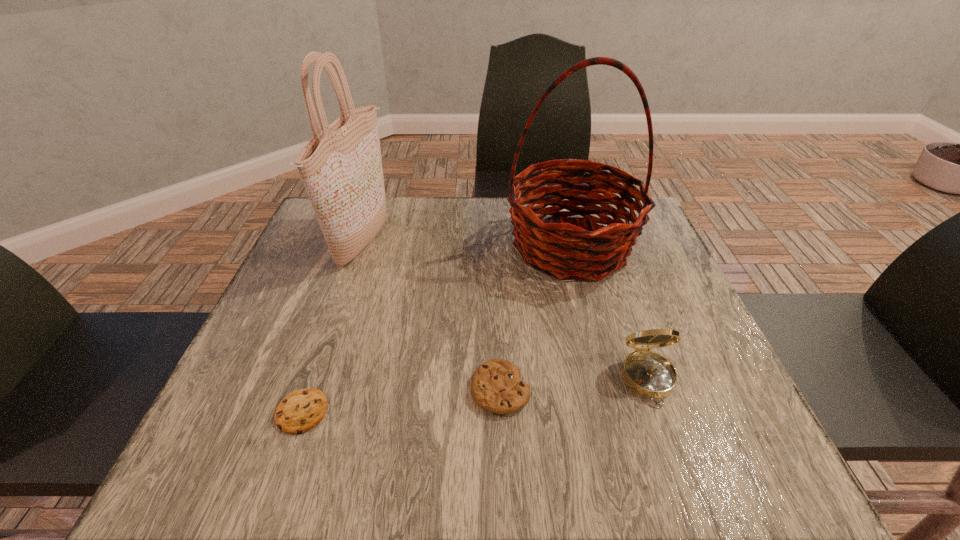
Find the location of `object that is at the near left corner`. object that is at the near left corner is located at coordinates (300, 411).

Find the location of a particular element. The width and height of the screenshot is (960, 540). object situated at the far right corner is located at coordinates (565, 250).

At what (x,y) coordinates should I click in order to perform the action: click on vacant space at the far edge of the desktop. Please return your answer as a coordinate pair (x, y). Image resolution: width=960 pixels, height=540 pixels. Looking at the image, I should click on (467, 202).

Find the location of a particular element. The image size is (960, 540). vacant space at the near edge of the desktop is located at coordinates (572, 439).

Where is `free space at the left edge of the desktop`? This screenshot has width=960, height=540. free space at the left edge of the desktop is located at coordinates (275, 369).

Where is `free point at the right edge`? The height and width of the screenshot is (540, 960). free point at the right edge is located at coordinates (633, 285).

The height and width of the screenshot is (540, 960). Identify the location of vacant space at the far left corner of the desktop. point(317,224).

Where is `vacant space at the near left corner of the desktop`? vacant space at the near left corner of the desktop is located at coordinates (265, 465).

Image resolution: width=960 pixels, height=540 pixels. What are the coordinates of `empty location between the shopping bag and the taller cookie` in the screenshot? It's located at (432, 315).

The height and width of the screenshot is (540, 960). In order to click on free space between the taller cookie and the compass in this screenshot , I will do `click(574, 385)`.